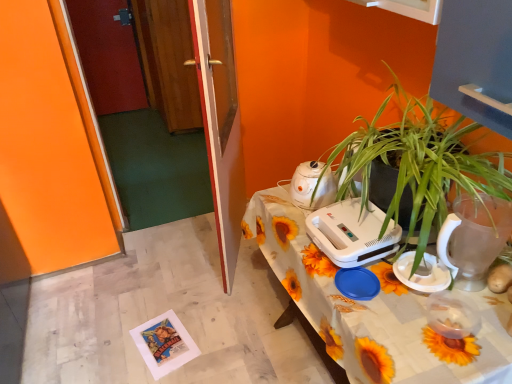
What do you see at coordinates (352, 233) in the screenshot?
I see `white plastic appliance at upper right, which is the 3th appliance in front-to-back order` at bounding box center [352, 233].

Locate an element on the screen. The image size is (512, 384). white plastic table at center is located at coordinates (371, 309).

The image size is (512, 384). Describe the element at coordinates (176, 88) in the screenshot. I see `wooden door at left, placed as the 2th glass door when sorted from back to front` at that location.

Image resolution: width=512 pixels, height=384 pixels. In order to click on white plastic appliance at upper right, the 2th appliance when ordered from back to front in this screenshot , I will do `click(352, 233)`.

Between white plastic table at center and wooden door at left, the 3th glass door from the front, which one has larger width?

With larger width is wooden door at left, the 3th glass door from the front.

From a real-world perspective, which is physically above, white plastic table at center or wooden door at left, which is the first glass door in back-to-front order?

wooden door at left, which is the first glass door in back-to-front order, from a real-world perspective.

Is white plastic table at center facing towards wooden door at left, the 3th glass door from the front?

No, white plastic table at center is not aimed at wooden door at left, the 3th glass door from the front.

From the image's perspective, relative to wooden door at left, which is the first glass door in back-to-front order, is white plastic table at center above or below?

white plastic table at center is situated lower than wooden door at left, which is the first glass door in back-to-front order, in the image.

Is white plastic kettle at center, the 4th appliance viewed from the front, completely or partially inside white plastic table at center?

Actually, white plastic kettle at center, the 4th appliance viewed from the front, is outside white plastic table at center.

Which object is positioned more to the right, white plastic table at center or white plastic kettle at center, the 4th appliance viewed from the front?

From the viewer's perspective, white plastic table at center appears more on the right side.

Between white plastic table at center and white plastic kettle at center, which is the 1th appliance in back-to-front order, which one has smaller size?

white plastic kettle at center, which is the 1th appliance in back-to-front order, is smaller.

From the image's perspective, between white plastic table at center and white plastic kettle at center, the 4th appliance viewed from the front, which one is located above?

From the image's view, white plastic kettle at center, the 4th appliance viewed from the front, is above.

Which object is positioned more to the left, green leafy plant at right or wooden door at left, the 3th glass door from the front?

wooden door at left, the 3th glass door from the front.

Find the location of a particular element. The image size is (512, 384). the 3rd glass door positioned below the green leafy plant at right (from a real-world perspective) is located at coordinates (170, 62).

Which is farther from the camera, (418,198) or (145,7)?

The point (145,7) is farther.

Relative to wooden door at left, which is the first glass door in back-to-front order, is green leafy plant at right in front or behind?

green leafy plant at right is in front of wooden door at left, which is the first glass door in back-to-front order.

Considering the positions of objects white plastic plate at lower right, positioned as the 3th appliance in back-to-front order, and green leafy plant at right in the image provided, who is more to the left, white plastic plate at lower right, positioned as the 3th appliance in back-to-front order, or green leafy plant at right?

Positioned to the left is green leafy plant at right.

Based on the photo, is white plastic plate at lower right, acting as the second appliance starting from the front, taller or shorter than green leafy plant at right?

white plastic plate at lower right, acting as the second appliance starting from the front, is shorter than green leafy plant at right.

Find the location of a particular element. The width and height of the screenshot is (512, 384). the 1st appliance counting from the right of the green leafy plant at right is located at coordinates (422, 273).

From a real-world perspective, is white plastic plate at lower right, positioned as the 3th appliance in back-to-front order, positioned over green leafy plant at right based on gravity?

Incorrect, from a real-world perspective, white plastic plate at lower right, positioned as the 3th appliance in back-to-front order, is lower than green leafy plant at right.

In terms of size, does wooden door at left, placed as the 2th glass door when sorted from back to front, appear bigger or smaller than green leafy plant at right?

In the image, wooden door at left, placed as the 2th glass door when sorted from back to front, appears to be smaller than green leafy plant at right.

Between wooden door at left, placed as the 2th glass door when sorted from back to front, and green leafy plant at right, which one appears on the left side from the viewer's perspective?

wooden door at left, placed as the 2th glass door when sorted from back to front, is more to the left.

Which is correct: wooden door at left, which is the second glass door from front to back, is inside green leafy plant at right, or outside of it?

wooden door at left, which is the second glass door from front to back, exists outside the volume of green leafy plant at right.

Considering the positions of objects wooden door at left, placed as the 2th glass door when sorted from back to front, and green leafy plant at right in the image provided, who is behind, wooden door at left, placed as the 2th glass door when sorted from back to front, or green leafy plant at right?

wooden door at left, placed as the 2th glass door when sorted from back to front.

Does point (298, 178) come closer to viewer compared to point (336, 210)?

No, (298, 178) is further to viewer.

Does white plastic kettle at center, the 4th appliance viewed from the front, have a lesser width compared to white plastic appliance at upper right, which is the 3th appliance in front-to-back order?

Indeed, white plastic kettle at center, the 4th appliance viewed from the front, has a lesser width compared to white plastic appliance at upper right, which is the 3th appliance in front-to-back order.

Is white plastic kettle at center, the 4th appliance viewed from the front, touching white plastic appliance at upper right, the 2th appliance when ordered from back to front?

No.

From the picture: Is the surface of white plastic plate at lower right, positioned as the 3th appliance in back-to-front order, in direct contact with wooden door at left, placed as the 2th glass door when sorted from back to front?

white plastic plate at lower right, positioned as the 3th appliance in back-to-front order, is not next to wooden door at left, placed as the 2th glass door when sorted from back to front, and they're not touching.

Which is in front, point (423, 273) or point (231, 150)?

The point (423, 273) is in front.

Considering the sizes of objects white plastic plate at lower right, acting as the second appliance starting from the front, and wooden door at left, placed as the 2th glass door when sorted from back to front, in the image provided, who is thinner, white plastic plate at lower right, acting as the second appliance starting from the front, or wooden door at left, placed as the 2th glass door when sorted from back to front,?

wooden door at left, placed as the 2th glass door when sorted from back to front, is thinner.

Considering the relative sizes of white plastic plate at lower right, acting as the second appliance starting from the front, and wooden door at left, which is the second glass door from front to back, in the image provided, is white plastic plate at lower right, acting as the second appliance starting from the front, shorter than wooden door at left, which is the second glass door from front to back,?

Yes, white plastic plate at lower right, acting as the second appliance starting from the front, is shorter than wooden door at left, which is the second glass door from front to back.

Find the location of a particular element. The height and width of the screenshot is (384, 512). table below the wooden door at left, which is the first glass door in back-to-front order (from a real-world perspective) is located at coordinates (371, 309).

The width and height of the screenshot is (512, 384). Find the location of `table on the right of white plastic kettle at center, the 4th appliance viewed from the front`. table on the right of white plastic kettle at center, the 4th appliance viewed from the front is located at coordinates (371, 309).

Looking at the image, which one is located further to white plastic appliance at upper right, the 2th appliance when ordered from back to front, white plastic table at center or green leafy plant at right?

Among the two, green leafy plant at right is located further to white plastic appliance at upper right, the 2th appliance when ordered from back to front.

Looking at the image, which one is located closer to green leafy plant at right, white plastic appliance at upper right, the 2th appliance when ordered from back to front, or white plastic plate at lower right, positioned as the 3th appliance in back-to-front order?

white plastic appliance at upper right, the 2th appliance when ordered from back to front, lies closer to green leafy plant at right than the other object.

Looking at the image, which one is located further to wooden door at left, the 3th glass door from the front, white plastic kettle at center, which is the 1th appliance in back-to-front order, or transparent glass door at center, which is the 1th glass door from front to back?

Based on the image, white plastic kettle at center, which is the 1th appliance in back-to-front order, appears to be further to wooden door at left, the 3th glass door from the front.

Estimate the real-world distances between objects in this image. Which object is further from white plastic table at center, wooden door at left, which is the first glass door in back-to-front order, or wooden door at left, which is the second glass door from front to back?

wooden door at left, which is the first glass door in back-to-front order, lies further to white plastic table at center than the other object.

Considering their positions, is white plastic plate at lower right, acting as the second appliance starting from the front, positioned closer to white plastic kettle at center, which is the 1th appliance in back-to-front order, than transparent glass door at center, which appears as the third glass door when viewed from the back?

white plastic plate at lower right, acting as the second appliance starting from the front, is positioned closer to the anchor white plastic kettle at center, which is the 1th appliance in back-to-front order.

In the scene shown: From the image, which object appears to be farther from white plastic kettle at center, which is the 1th appliance in back-to-front order, white plastic table at center or wooden door at left, placed as the 2th glass door when sorted from back to front?

wooden door at left, placed as the 2th glass door when sorted from back to front, lies further to white plastic kettle at center, which is the 1th appliance in back-to-front order, than the other object.

When comparing their distances from white plastic plate at lower right, positioned as the 3th appliance in back-to-front order, does transparent plastic pitcher at right, the 1th appliance when ordered from front to back, or green leafy plant at right seem further?

green leafy plant at right lies further to white plastic plate at lower right, positioned as the 3th appliance in back-to-front order, than the other object.

From the image, which object appears to be farther from transparent plastic pitcher at right, the 1th appliance when ordered from front to back, white plastic appliance at upper right, the 2th appliance when ordered from back to front, or transparent glass door at center, which is the 1th glass door from front to back?

transparent glass door at center, which is the 1th glass door from front to back.

Image resolution: width=512 pixels, height=384 pixels. Identify the location of houseplant between transparent glass door at center, which is the 1th glass door from front to back, and white plastic table at center, in the vertical direction. (419, 162).

The image size is (512, 384). I want to click on table between transparent glass door at center, which is the 1th glass door from front to back, and transparent plastic pitcher at right, the 1th appliance when ordered from front to back, in the horizontal direction, so click(371, 309).

At what (x,y) coordinates should I click in order to perform the action: click on glass door between wooden door at left, which is the second glass door from front to back, and white plastic plate at lower right, positioned as the 3th appliance in back-to-front order, from left to right. Please return your answer as a coordinate pair (x, y). The height and width of the screenshot is (384, 512). Looking at the image, I should click on (220, 124).

Locate an element on the screen. appliance located between green leafy plant at right and white plastic plate at lower right, acting as the second appliance starting from the front, in the depth direction is located at coordinates (474, 238).